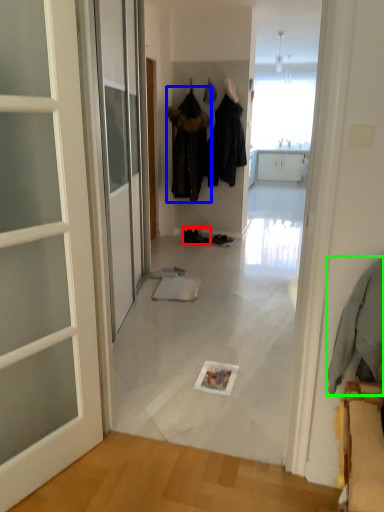
Question: Considering the real-world distances, which object is farthest from footwear (highlighted by a red box)? clothing (highlighted by a blue box) or clothing (highlighted by a green box)?

Choices:
 (A) clothing
 (B) clothing

Answer: (B)